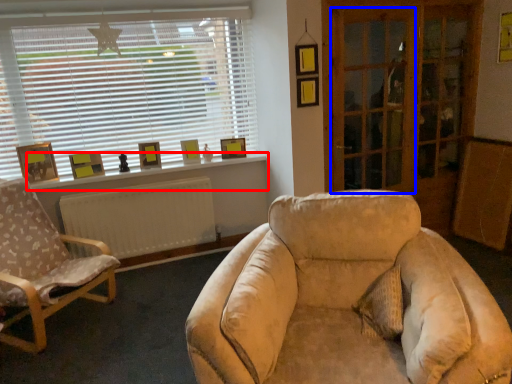
Question: Among these objects, which one is farthest to the camera, window sill (highlighted by a red box) or screen door (highlighted by a blue box)?

Choices:
 (A) window sill
 (B) screen door

Answer: (A)